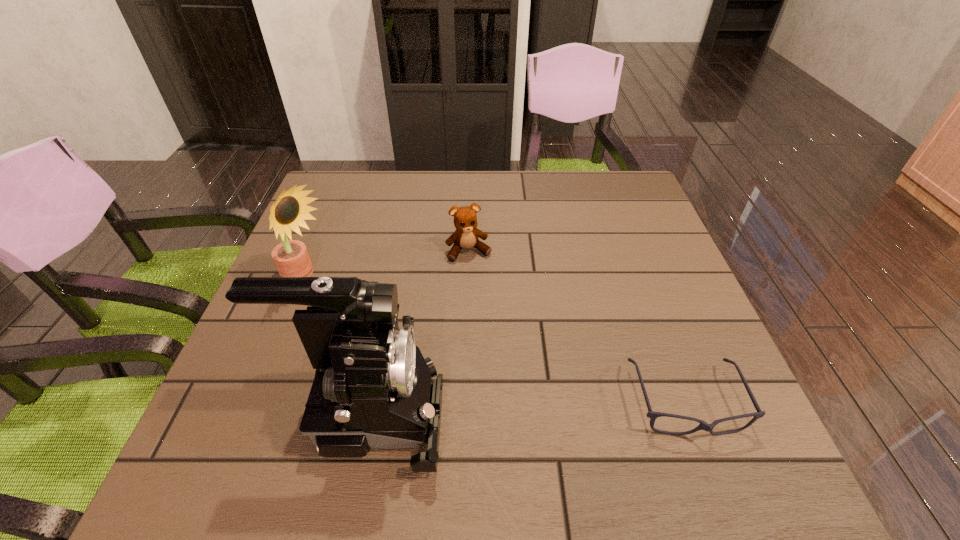
Identify the location of free point that satisfies the following two spatial constraints: 1. on the front side of the camcorder; 2. on the lens mount of the leftmost object. (252, 414).